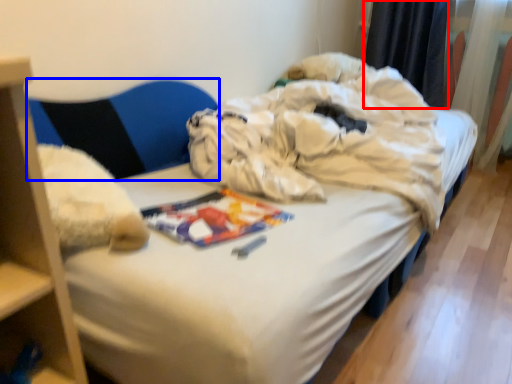
Question: Which object appears farthest to the camera in this image, curtain (highlighted by a red box) or armchair (highlighted by a blue box)?

Choices:
 (A) curtain
 (B) armchair

Answer: (A)